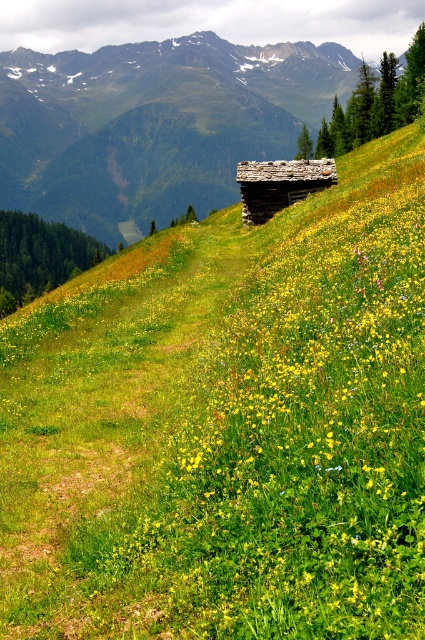
Question: Which of the following is the farthest from the observer?

Choices:
 (A) rustic wooden cabin at center
 (B) rustic wooden log cabin at center

Answer: (A)

Question: Is rustic wooden cabin at center above rustic wooden log cabin at center?

Choices:
 (A) yes
 (B) no

Answer: (A)

Question: Which of the following is the closest to the observer?

Choices:
 (A) rustic wooden log cabin at center
 (B) rustic wooden cabin at center

Answer: (A)

Question: In this image, where is rustic wooden cabin at center located relative to rustic wooden log cabin at center?

Choices:
 (A) left
 (B) right

Answer: (A)

Question: Can you confirm if rustic wooden cabin at center is wider than rustic wooden log cabin at center?

Choices:
 (A) no
 (B) yes

Answer: (B)